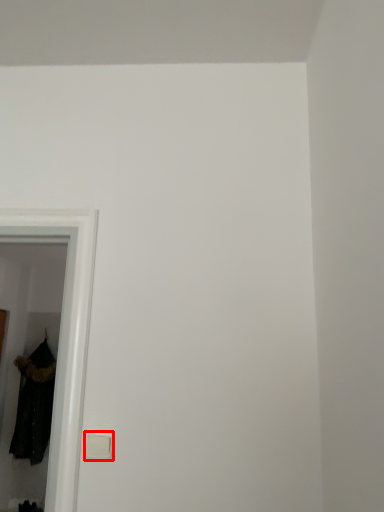
Question: From the image's perspective, considering the relative positions of light switch (annotated by the red box) and clothing in the image provided, where is light switch (annotated by the red box) located with respect to the staircase?

Choices:
 (A) below
 (B) above

Answer: (B)